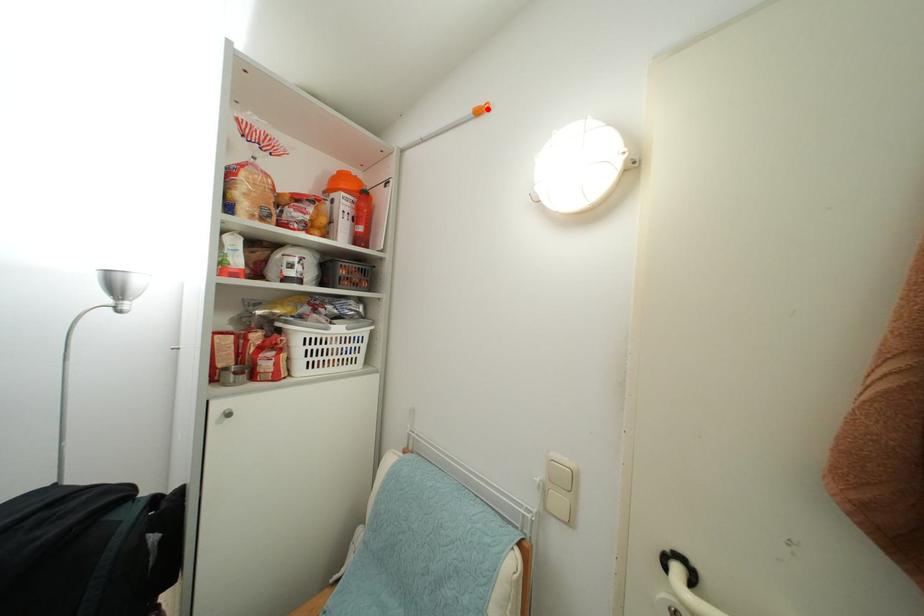
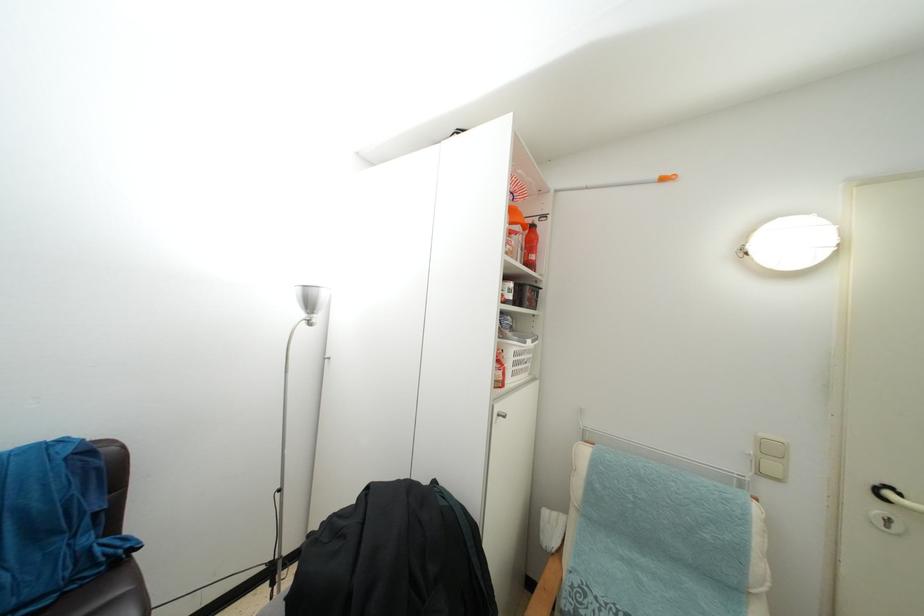
Question: I am providing you with two images of the same scene from different viewpoints. A red point is marked on the first image. Is the red point's position out of view in image 2?

Choices:
 (A) Yes
 (B) No

Answer: (B)